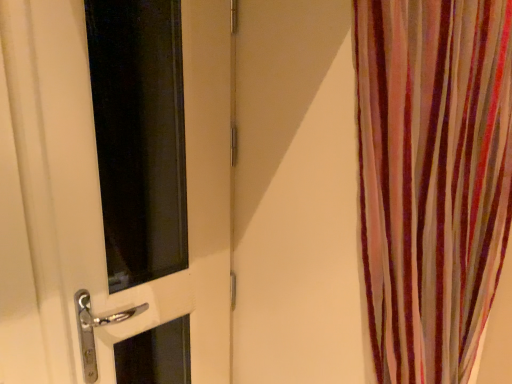
Question: Does white glossy door at left lie behind striped fabric curtain at right?

Choices:
 (A) no
 (B) yes

Answer: (B)

Question: Would you consider white glossy door at left to be distant from striped fabric curtain at right?

Choices:
 (A) yes
 (B) no

Answer: (B)

Question: From a real-world perspective, does white glossy door at left sit lower than striped fabric curtain at right?

Choices:
 (A) no
 (B) yes

Answer: (B)

Question: Does white glossy door at left have a larger size compared to striped fabric curtain at right?

Choices:
 (A) no
 (B) yes

Answer: (A)

Question: Is white glossy door at left wider than striped fabric curtain at right?

Choices:
 (A) yes
 (B) no

Answer: (B)

Question: Is white glossy door at left thinner than striped fabric curtain at right?

Choices:
 (A) yes
 (B) no

Answer: (A)

Question: From a real-world perspective, is striped fabric curtain at right positioned under white glossy door at left based on gravity?

Choices:
 (A) no
 (B) yes

Answer: (A)

Question: Does striped fabric curtain at right come in front of white glossy door at left?

Choices:
 (A) no
 (B) yes

Answer: (B)

Question: From the image's perspective, is striped fabric curtain at right located beneath white glossy door at left?

Choices:
 (A) yes
 (B) no

Answer: (A)

Question: From the image's perspective, is striped fabric curtain at right over white glossy door at left?

Choices:
 (A) yes
 (B) no

Answer: (B)

Question: Is striped fabric curtain at right not near white glossy door at left?

Choices:
 (A) yes
 (B) no

Answer: (B)

Question: Is striped fabric curtain at right shorter than white glossy door at left?

Choices:
 (A) no
 (B) yes

Answer: (B)

Question: Is white glossy door at left inside or outside of striped fabric curtain at right?

Choices:
 (A) inside
 (B) outside

Answer: (B)